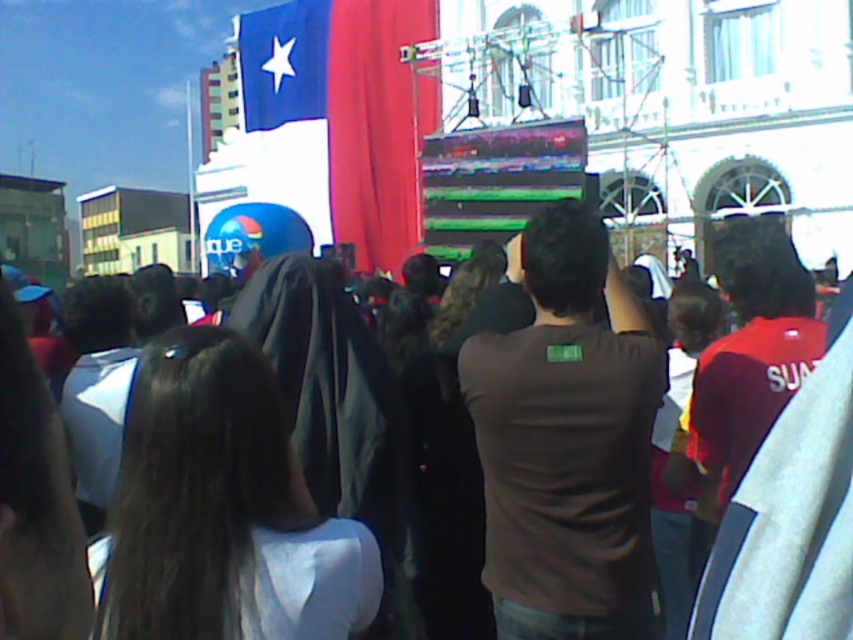
Question: Which of the following is the closest to the observer?

Choices:
 (A) [x=364, y=72]
 (B) [x=511, y=620]
 (C) [x=492, y=556]

Answer: (B)

Question: Among these points, which one is nearest to the camera?

Choices:
 (A) (775, 625)
 (B) (369, 131)

Answer: (A)

Question: Which point is closer to the camera taking this photo?

Choices:
 (A) 584,205
 (B) 422,83
 (C) 849,340

Answer: (C)

Question: Does brown fabric crowd at center appear on the right side of red fabric flag at center?

Choices:
 (A) yes
 (B) no

Answer: (A)

Question: Does brown matte shirt at center have a larger size compared to brown fabric crowd at center?

Choices:
 (A) no
 (B) yes

Answer: (A)

Question: Does brown fabric crowd at center lie behind red fabric flag at center?

Choices:
 (A) yes
 (B) no

Answer: (B)